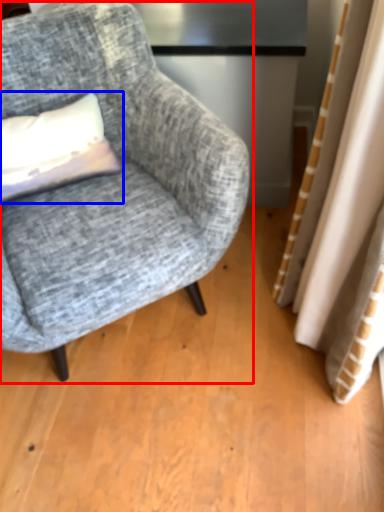
Question: Which object is further to the camera taking this photo, chair (highlighted by a red box) or pillow (highlighted by a blue box)?

Choices:
 (A) chair
 (B) pillow

Answer: (B)